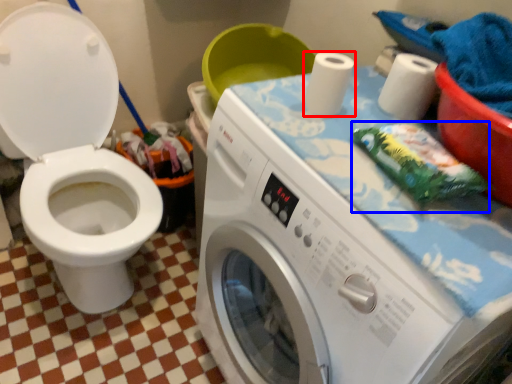
Question: Among these objects, which one is nearest to the camera, toilet paper (highlighted by a red box) or material (highlighted by a blue box)?

Choices:
 (A) toilet paper
 (B) material

Answer: (B)